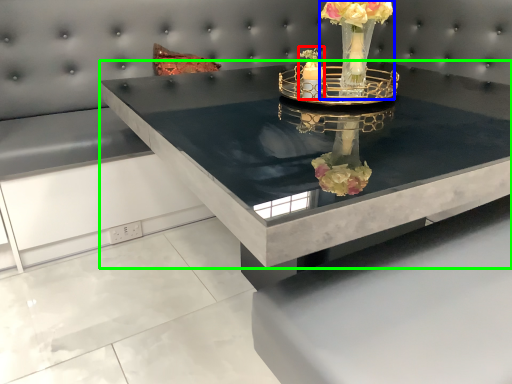
Question: Which object is the closest to the candle holder (highlighted by a red box)? Choose among these: floral arrangement (highlighted by a blue box) or table (highlighted by a green box).

Choices:
 (A) floral arrangement
 (B) table

Answer: (A)